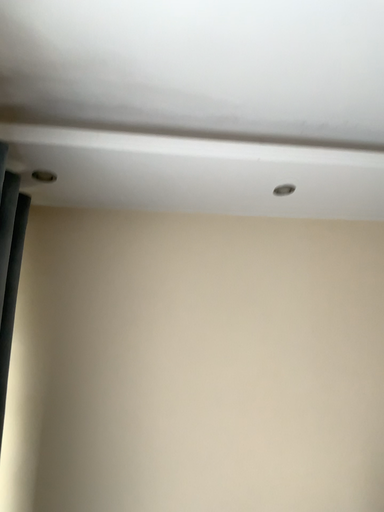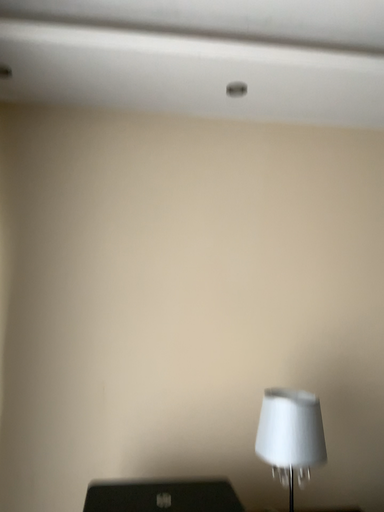
Question: How did the camera likely rotate when shooting the video?

Choices:
 (A) rotated downward
 (B) rotated upward

Answer: (A)